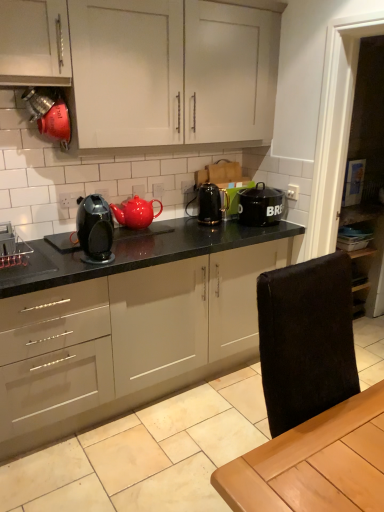
Image resolution: width=384 pixels, height=512 pixels. What are the coordinates of `vacant space underneath matte black coffee maker at center (from a real-world perspective)` in the screenshot? It's located at (97, 259).